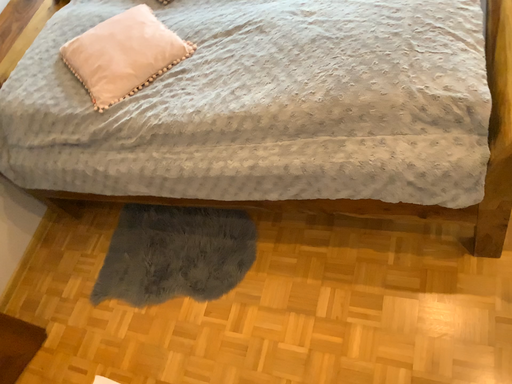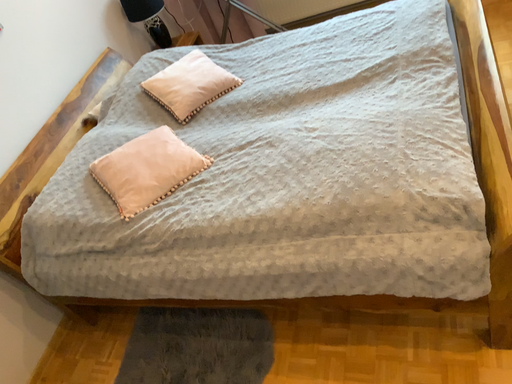
Question: How did the camera likely rotate when shooting the video?

Choices:
 (A) rotated downward
 (B) rotated upward

Answer: (B)